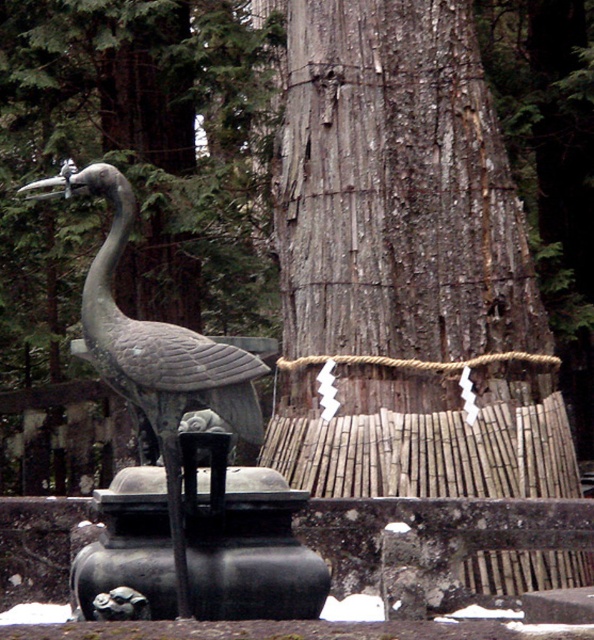
Based on the photo, you are a visitor at the shrine and want to touch the gray textured wood at center. Where exactly should you reach out to in the image to locate it?

The gray textured wood at center is located at point coordinates of (397, 189).